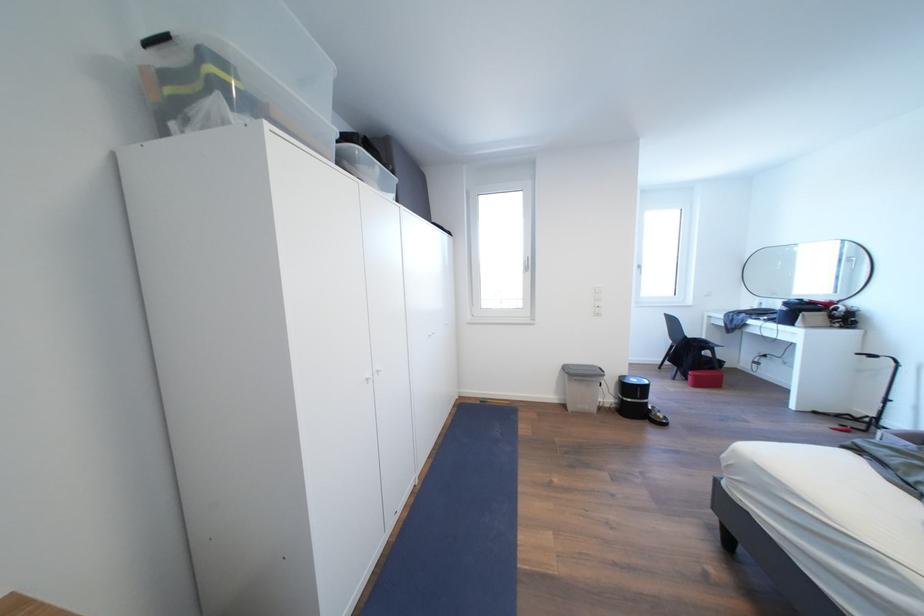
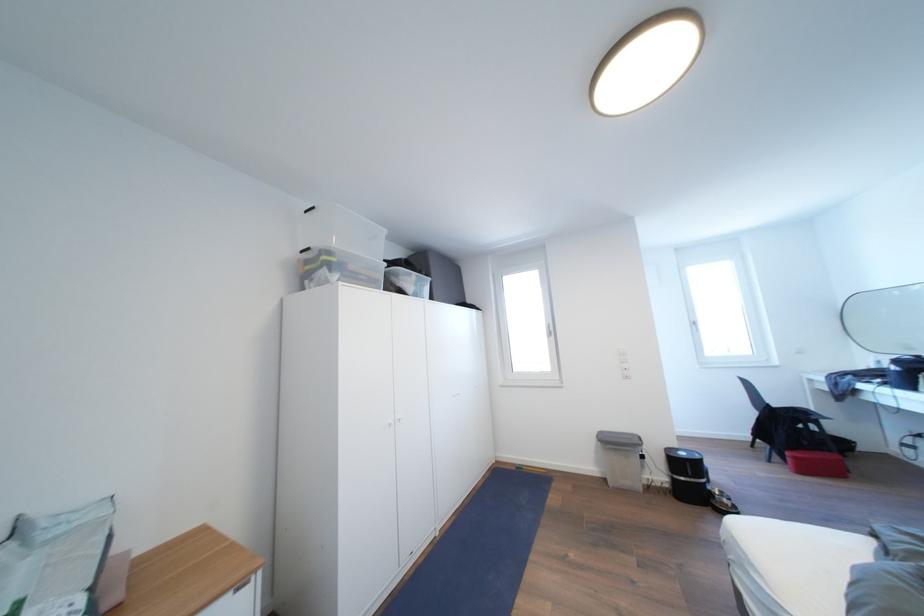
Where in the second image is the point corresponding to [703,381] from the first image?

(803, 463)